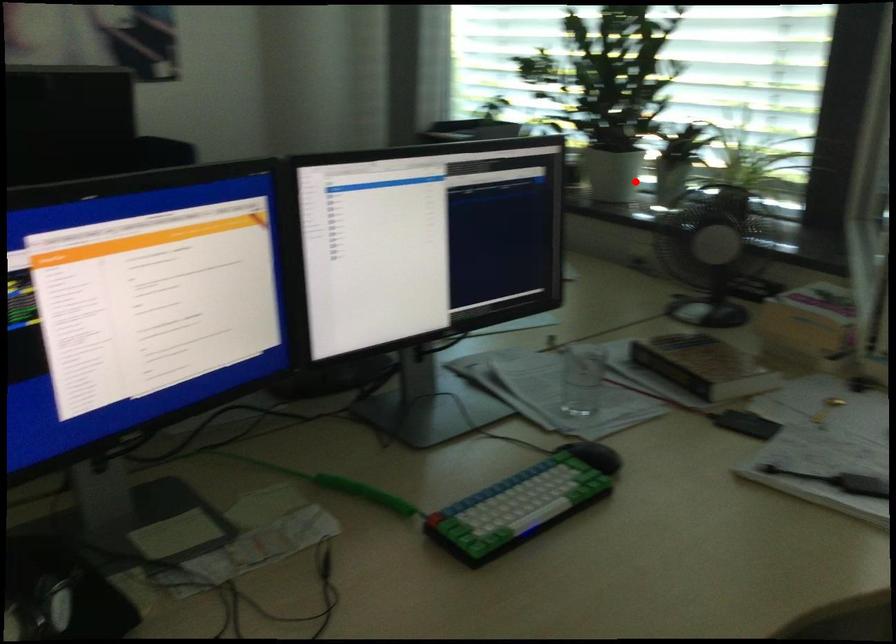
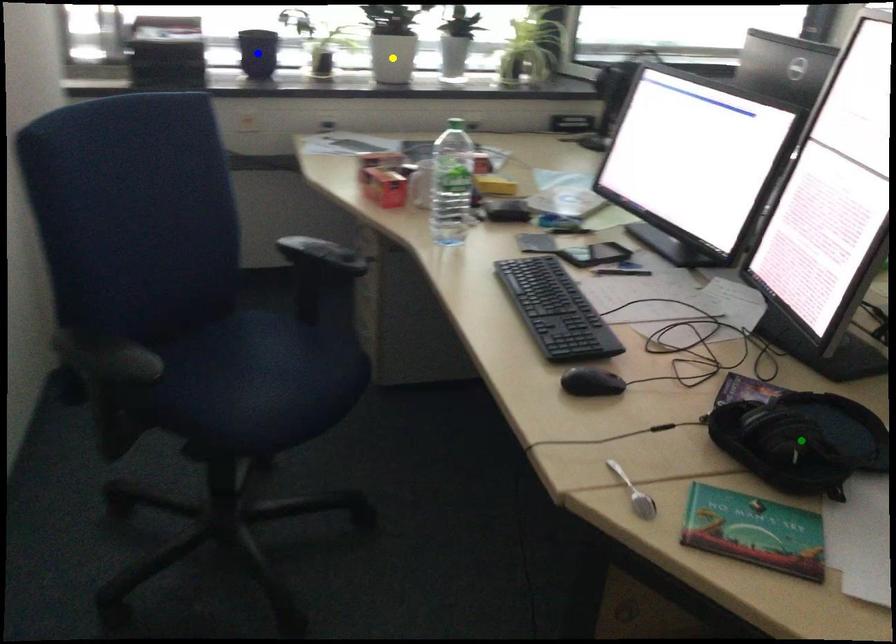
Question: I am providing you with two images of the same scene from different viewpoints. A red point is marked on the first image. You are given multiple points on the second image. Which point in image 2 represents the same 3d spot as the red point in image 1?

Choices:
 (A) blue point
 (B) yellow point
 (C) green point

Answer: (B)